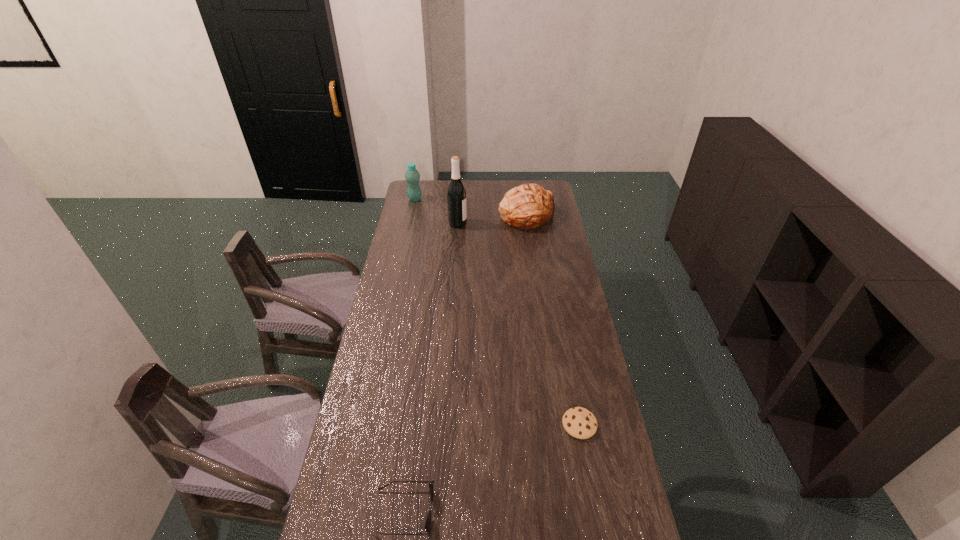
In order to click on empty space that is in between the tallest object and the nearest object in this screenshot , I will do `click(431, 367)`.

At what (x,y) coordinates should I click in order to perform the action: click on unoccupied area between the fourth farthest object and the wine bottle. Please return your answer as a coordinate pair (x, y). Image resolution: width=960 pixels, height=540 pixels. Looking at the image, I should click on (518, 324).

The width and height of the screenshot is (960, 540). What are the coordinates of `empty space between the cookie and the bread` in the screenshot? It's located at (554, 320).

You are a GUI agent. You are given a task and a screenshot of the screen. Output one action in this format:
    pyautogui.click(x=<x>, y=<y>)
    Task: Click on the vacant space that's between the tallest object and the second tallest object
    Image resolution: width=960 pixels, height=540 pixels.
    Given the screenshot: What is the action you would take?
    click(x=437, y=211)

Find the location of a particular element. The image size is (960, 540). vacant space in between the sunglasses and the leftmost object is located at coordinates (409, 355).

Locate an element on the screen. the closest object to the fourth tallest object is located at coordinates (580, 423).

Point out which object is positioned as the third nearest to the tallest object. Please provide its 2D coordinates. Your answer should be formatted as a tuple, i.e. [(x, y)], where the tuple contains the x and y coordinates of a point satisfying the conditions above.

[(580, 423)]

This screenshot has height=540, width=960. I want to click on blank area in the image that satisfies the following two spatial constraints: 1. on the label of the cookie; 2. on the right side of the wine bottle, so click(444, 424).

Identify the location of free space that satisfies the following two spatial constraints: 1. on the front side of the cookie; 2. on the right side of the bread. (558, 424).

I want to click on vacant space that satisfies the following two spatial constraints: 1. on the back side of the fourth farthest object; 2. on the label of the tallest object, so click(541, 224).